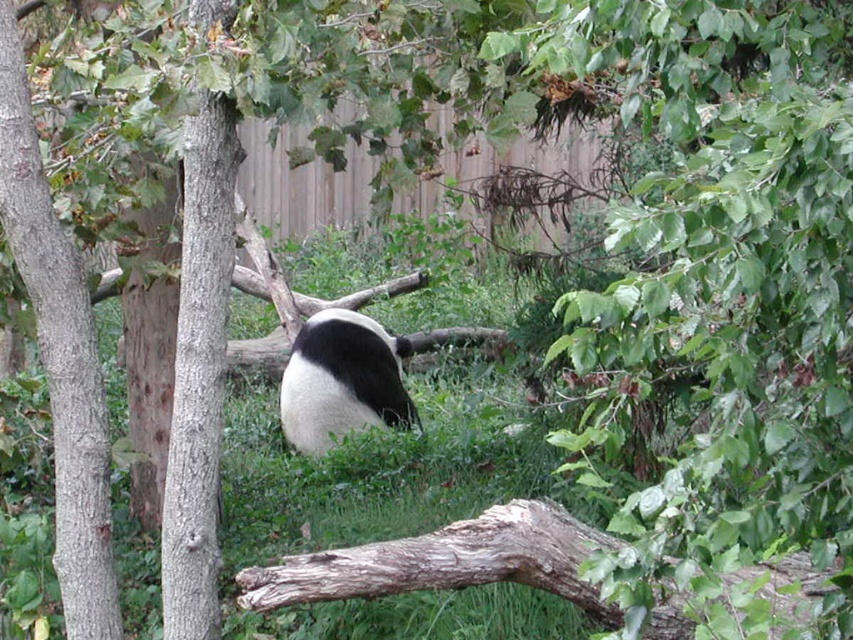
Which of these two, brown rough tree trunk at left or black and white fur panda at center, stands taller?

With more height is brown rough tree trunk at left.

Does brown rough tree trunk at left have a greater width compared to black and white fur panda at center?

Incorrect, brown rough tree trunk at left's width does not surpass black and white fur panda at center's.

Describe the element at coordinates (59, 356) in the screenshot. I see `brown rough tree trunk at left` at that location.

Locate an element on the screen. The height and width of the screenshot is (640, 853). brown rough tree trunk at left is located at coordinates [x=59, y=356].

Does point (90, 358) come closer to viewer compared to point (196, 145)?

No, it is behind (196, 145).

Is brown rough tree trunk at left positioned in front of gray rough bark tree trunk at left?

No, brown rough tree trunk at left is further to the viewer.

What do you see at coordinates (59, 356) in the screenshot? The height and width of the screenshot is (640, 853). I see `brown rough tree trunk at left` at bounding box center [59, 356].

At what (x,y) coordinates should I click in order to perform the action: click on brown rough tree trunk at left. Please return your answer as a coordinate pair (x, y). The height and width of the screenshot is (640, 853). Looking at the image, I should click on (59, 356).

Is gray rough bark tree trunk at left thinner than black and white fur panda at center?

Yes, gray rough bark tree trunk at left is thinner than black and white fur panda at center.

Does gray rough bark tree trunk at left have a lesser height compared to black and white fur panda at center?

Incorrect, gray rough bark tree trunk at left's height does not fall short of black and white fur panda at center's.

Between point (204, 221) and point (321, 349), which one is positioned in front?

Positioned in front is point (204, 221).

Identify the location of gray rough bark tree trunk at left. The height and width of the screenshot is (640, 853). (199, 371).